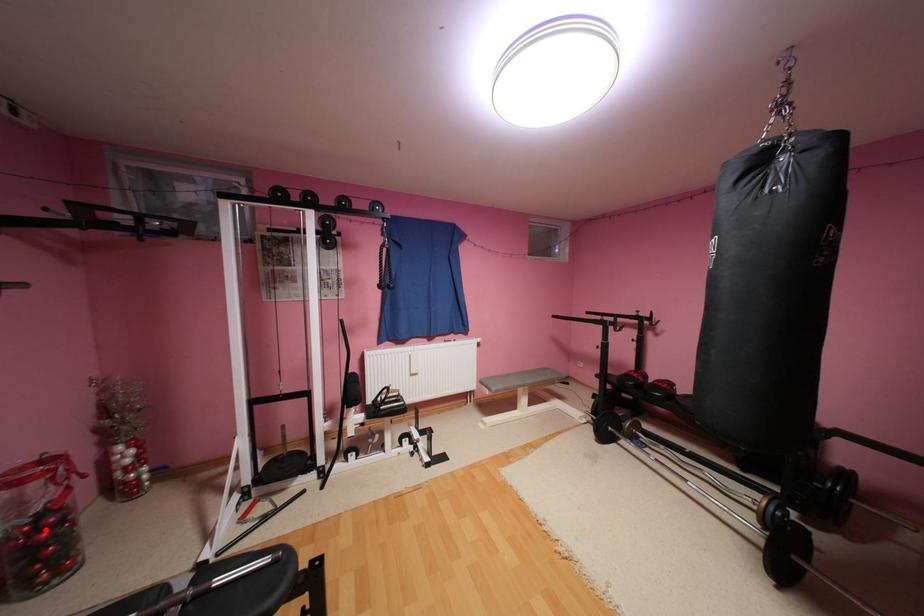
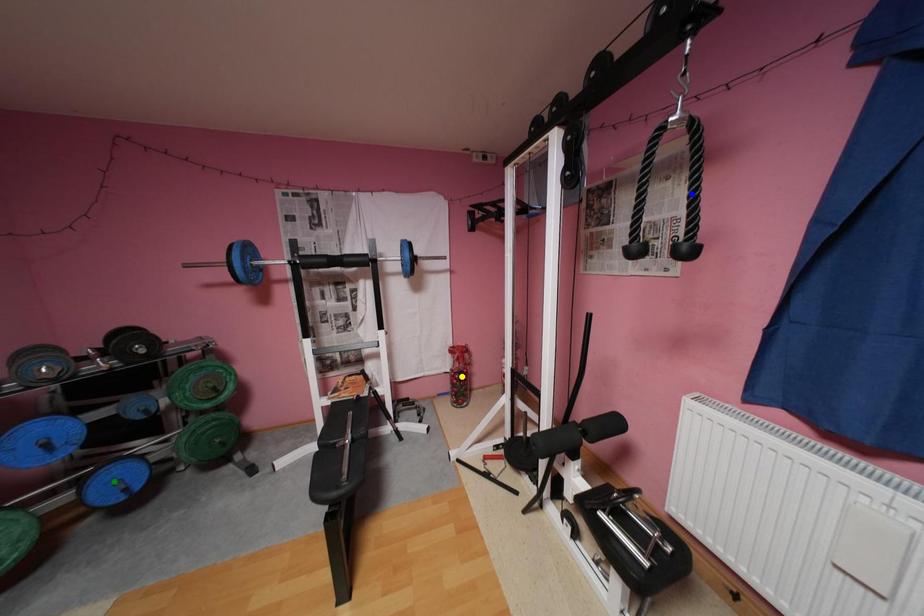
Question: I am providing you with two images of the same scene from different viewpoints. A red point is marked on the first image. You are given multiple points on the second image. In image 2, which mark is for the same physical point as the one in image 1?

Choices:
 (A) green point
 (B) yellow point
 (C) blue point

Answer: (B)